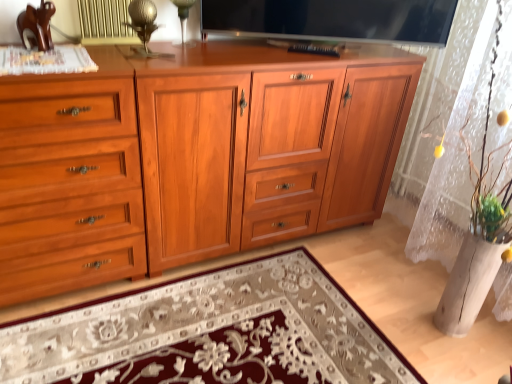
Question: Is shiny wood cabinet at center taller or shorter than floral carpet at center?

Choices:
 (A) tall
 (B) short

Answer: (A)

Question: Is shiny wood cabinet at center inside the boundaries of floral carpet at center, or outside?

Choices:
 (A) inside
 (B) outside

Answer: (B)

Question: Estimate the real-world distances between objects in this image. Which object is farther from the shiny wood cabinet at center?

Choices:
 (A) floral carpet at center
 (B) metallic gold table lamp at upper center, which is the first table lamp in front-to-back order
 (C) transparent glass table lamp at upper center, positioned as the 2th table lamp in front-to-back order
 (D) metallic gold radiator at upper center
 (E) matte wood cupboard at left

Answer: (C)

Question: Considering the real-world distances, which object is farthest from the shiny wood cabinet at center?

Choices:
 (A) transparent glass table lamp at upper center, the 1th table lamp positioned from the back
 (B) matte wood cupboard at left
 (C) flat screen tv at upper center
 (D) metallic gold table lamp at upper center, placed as the second table lamp when sorted from back to front
 (E) metallic gold radiator at upper center

Answer: (A)